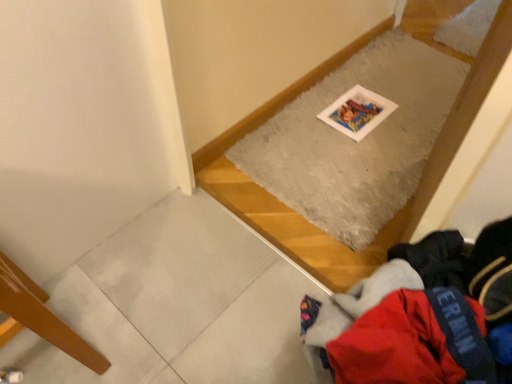
Question: Does wooden floorboard at lower left have a lesser height compared to red fleece jacket at lower right?

Choices:
 (A) yes
 (B) no

Answer: (B)

Question: Are wooden floorboard at lower left and red fleece jacket at lower right located far from each other?

Choices:
 (A) no
 (B) yes

Answer: (A)

Question: Considering the relative sizes of wooden floorboard at lower left and red fleece jacket at lower right in the image provided, is wooden floorboard at lower left wider than red fleece jacket at lower right?

Choices:
 (A) yes
 (B) no

Answer: (B)

Question: Is wooden floorboard at lower left taller than red fleece jacket at lower right?

Choices:
 (A) yes
 (B) no

Answer: (A)

Question: From a real-world perspective, is wooden floorboard at lower left on red fleece jacket at lower right?

Choices:
 (A) no
 (B) yes

Answer: (A)

Question: Does wooden floorboard at lower left contain red fleece jacket at lower right?

Choices:
 (A) yes
 (B) no

Answer: (B)

Question: Is gray fluffy mat at upper center positioned behind red fleece jacket at lower right?

Choices:
 (A) no
 (B) yes

Answer: (B)

Question: Can you confirm if gray fluffy mat at upper center is shorter than red fleece jacket at lower right?

Choices:
 (A) yes
 (B) no

Answer: (A)

Question: From the image's perspective, is gray fluffy mat at upper center under red fleece jacket at lower right?

Choices:
 (A) yes
 (B) no

Answer: (B)

Question: Is gray fluffy mat at upper center bigger than red fleece jacket at lower right?

Choices:
 (A) yes
 (B) no

Answer: (B)

Question: Does gray fluffy mat at upper center appear on the right side of red fleece jacket at lower right?

Choices:
 (A) yes
 (B) no

Answer: (A)

Question: Considering the relative positions of gray fluffy mat at upper center and red fleece jacket at lower right in the image provided, is gray fluffy mat at upper center to the left of red fleece jacket at lower right from the viewer's perspective?

Choices:
 (A) yes
 (B) no

Answer: (B)

Question: Is red fleece jacket at lower right facing towards wooden floorboard at lower left?

Choices:
 (A) yes
 (B) no

Answer: (B)